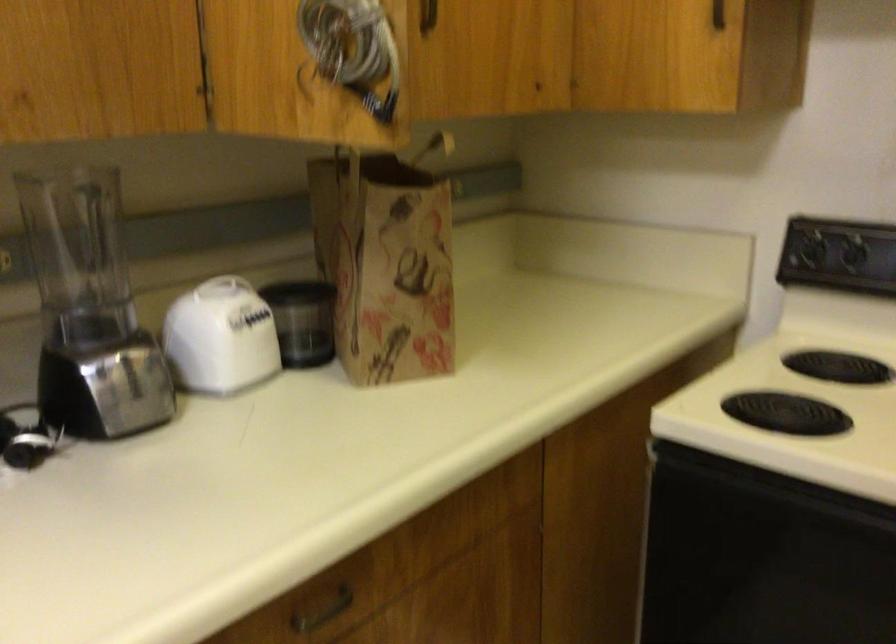
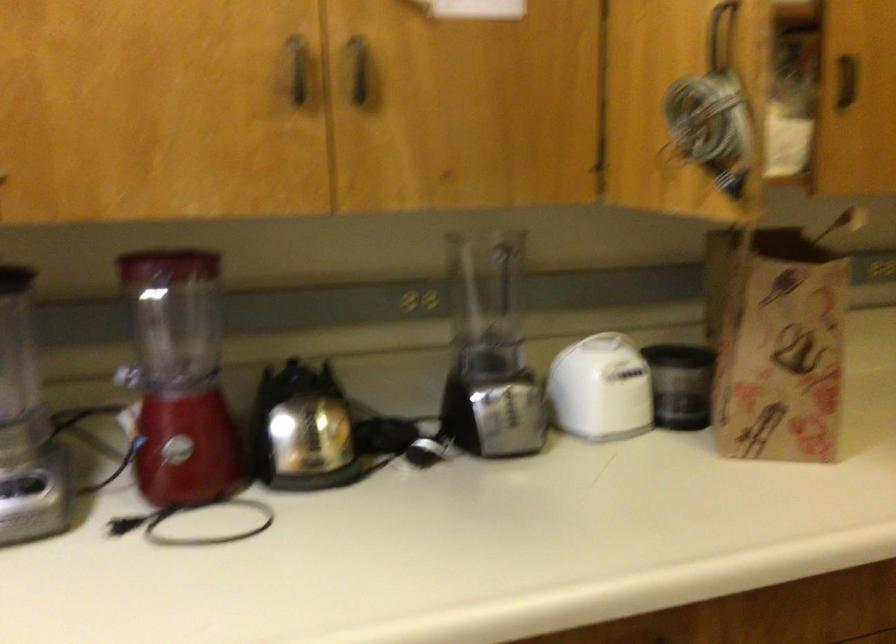
Find the pixel in the second image that matches (x=228, y=343) in the first image.

(600, 389)